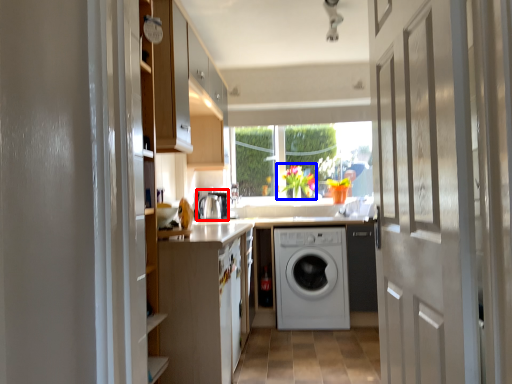
Question: Which of the following is the farthest to the observer, appliance (highlighted by a red box) or floral arrangement (highlighted by a blue box)?

Choices:
 (A) appliance
 (B) floral arrangement

Answer: (B)